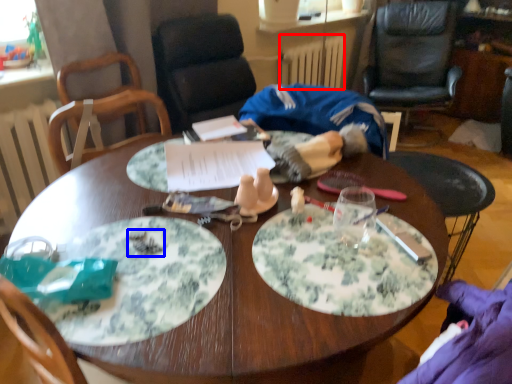
Question: Which object appears closest to the camera in this image, radiator (highlighted by a red box) or food (highlighted by a blue box)?

Choices:
 (A) radiator
 (B) food

Answer: (B)